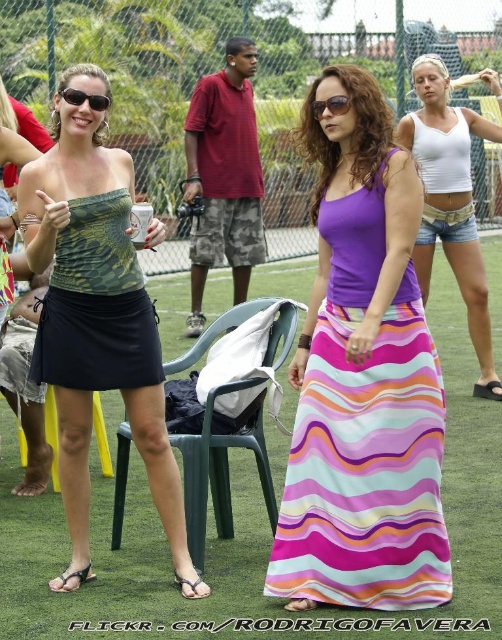
In the scene shown: You are a photographer at the event and want to capture a photo that includes both the matte green tube top at left and the sunglasses at center. What is the minimum distance you need to maintain between these two items to ensure they are both in the frame?

The minimum distance you need to maintain between the matte green tube top at left and the sunglasses at center is 5.30 feet to ensure both are in the frame.

You are standing at the origin point of the coordinate system in this image. A camouflage fabric skirt is located at point [96,305]. If you want to walk directly to the camouflage fabric skirt, which direction should you move in terms of the coordinate system?

In the coordinate system, moving towards the point [96,305] from the origin would require moving right along the x axis and down along the y axis since the x coordinate is positive and the y coordinate is also positive. However, in standard image coordinate systems, the y axis typically increases downward, so a positive y value would mean moving down. Therefore, to reach the camouflage fabric skirt at [96,305], you should move right and down from the origin.